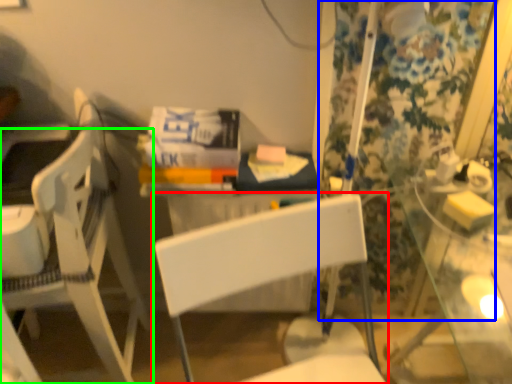
Question: Which object is the closest to the chair (highlighted by a red box)? Choose among these: curtain (highlighted by a blue box) or chair (highlighted by a green box).

Choices:
 (A) curtain
 (B) chair

Answer: (B)